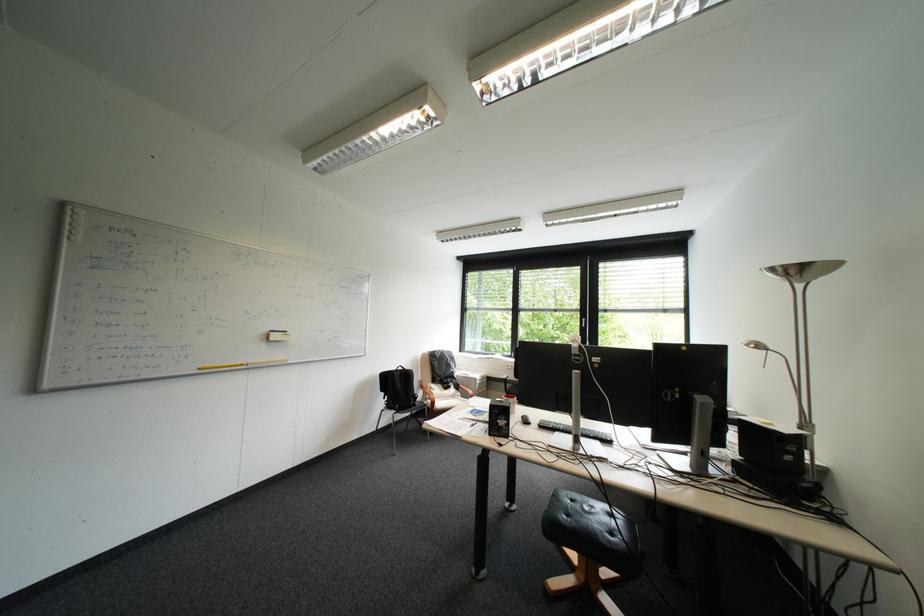
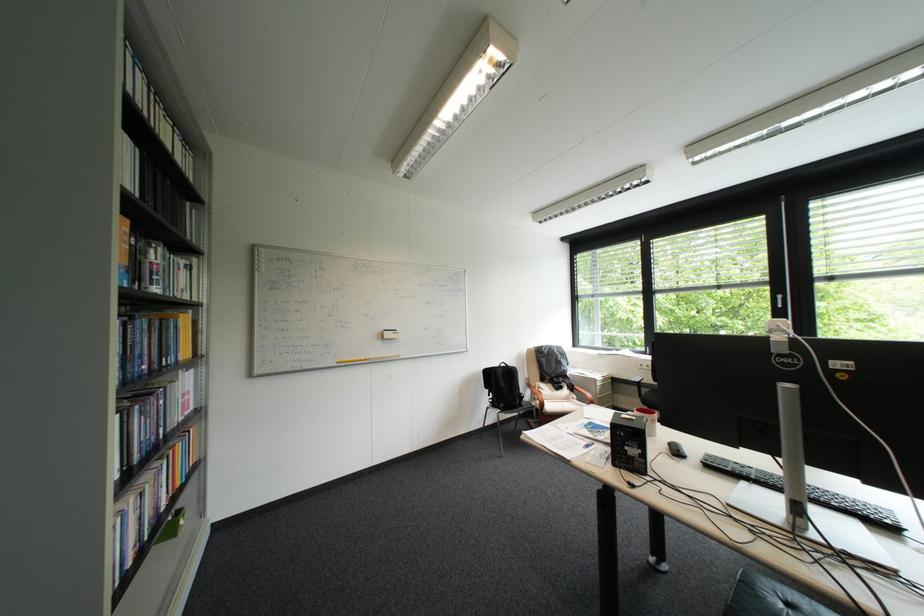
The point at (284, 331) is marked in the first image. Where is the corresponding point in the second image?

(397, 331)